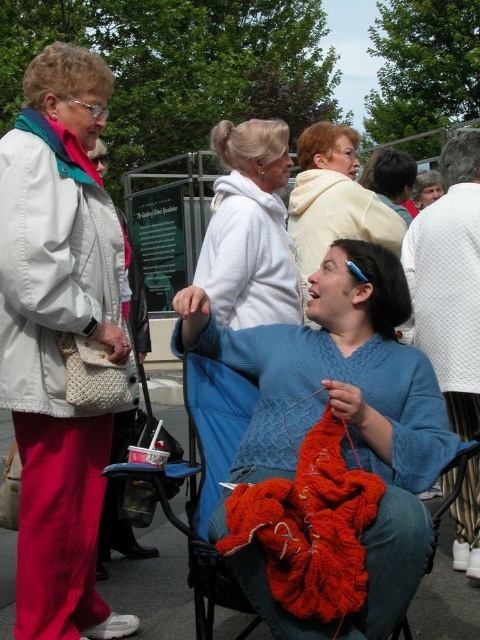
You are organizing a clothing donation drive and need to categorize items by size. You have two white garments in front of you, a white matte jacket at left and a white fleece sweater at center. Which garment should you place in the large size bin?

The white matte jacket at left has a larger size compared to the white fleece sweater at center, so it should be placed in the large size bin.

You are organizing a charity clothing drive and have limited space in the donation bin. You need to decide whether to place the white matte jacket at left and the white fleece sweater at center into the bin. Given their sizes, which one might not fit if the bin has a width restriction?

The white matte jacket at left is wider than the white fleece sweater at center, so the white matte jacket at left might not fit into the donation bin if there is a width restriction.